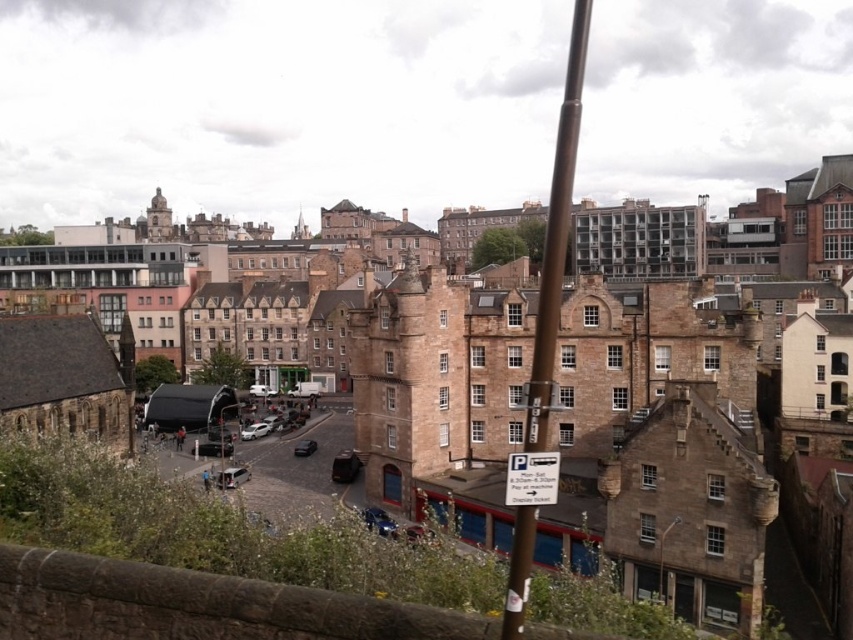
You are a tourist holding a camera and want to take a photo of the historic castle in the center. You notice the brown metallic pole at center and the white plastic parking sign at lower center might block your view. Which object is larger and could potentially block more of the castle in your photo?

The brown metallic pole at center is bigger than the white plastic parking sign at lower center, so it could potentially block more of the castle in your photo.